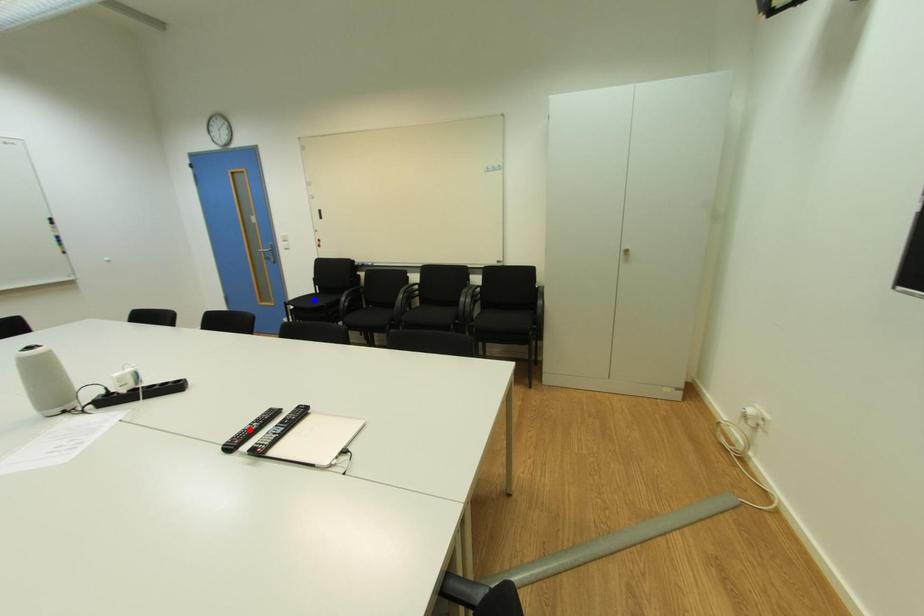
Question: Which of the two points in the image is closer to the camera?

Choices:
 (A) Blue point is closer.
 (B) Red point is closer.

Answer: (B)